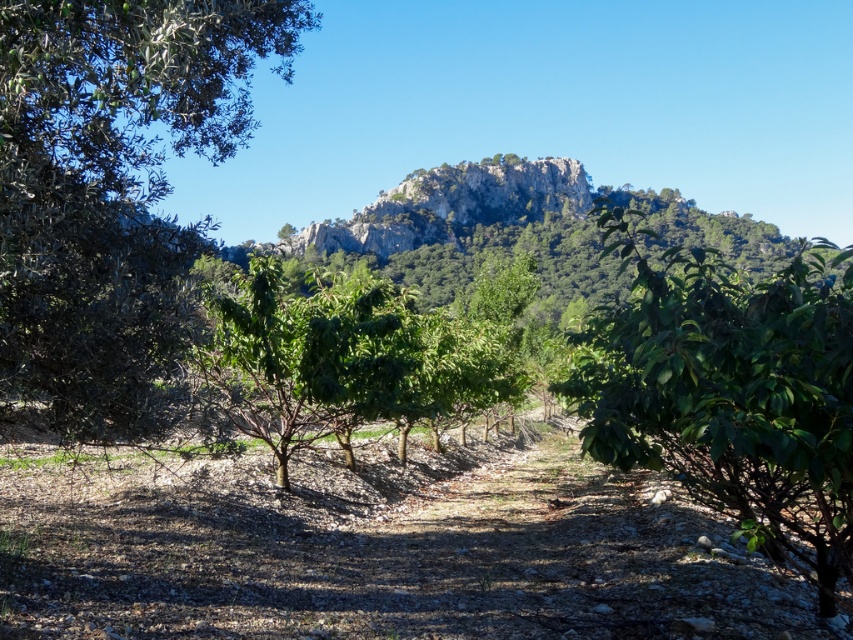
Question: Which object appears closest to the camera in this image?

Choices:
 (A) rocky gray mountain at center
 (B) green glossy tree at center
 (C) green leafy tree at center
 (D) green leafy tree at left

Answer: (B)

Question: Does green glossy tree at center have a greater width compared to rocky gray mountain at center?

Choices:
 (A) yes
 (B) no

Answer: (B)

Question: Can you confirm if green leafy tree at center is thinner than rocky gray mountain at center?

Choices:
 (A) no
 (B) yes

Answer: (B)

Question: Is green leafy tree at center closer to camera compared to rocky gray mountain at center?

Choices:
 (A) yes
 (B) no

Answer: (B)

Question: Which point appears closest to the camera in this image?

Choices:
 (A) (459, 259)
 (B) (706, 468)
 (C) (96, 228)
 (D) (477, 388)

Answer: (C)

Question: Which object appears closest to the camera in this image?

Choices:
 (A) rocky gray mountain at center
 (B) green leafy tree at center
 (C) green leafy tree at left
 (D) green glossy tree at center

Answer: (D)